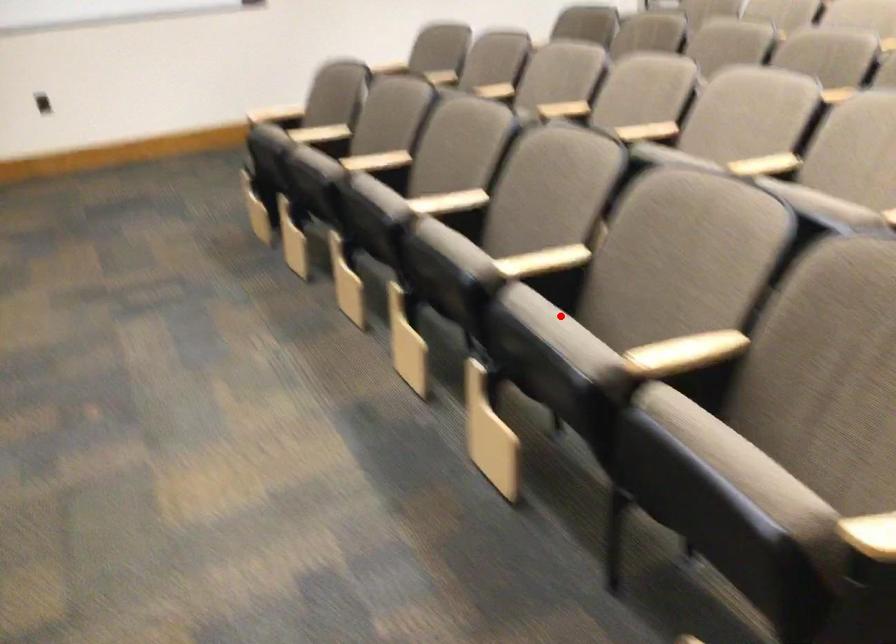
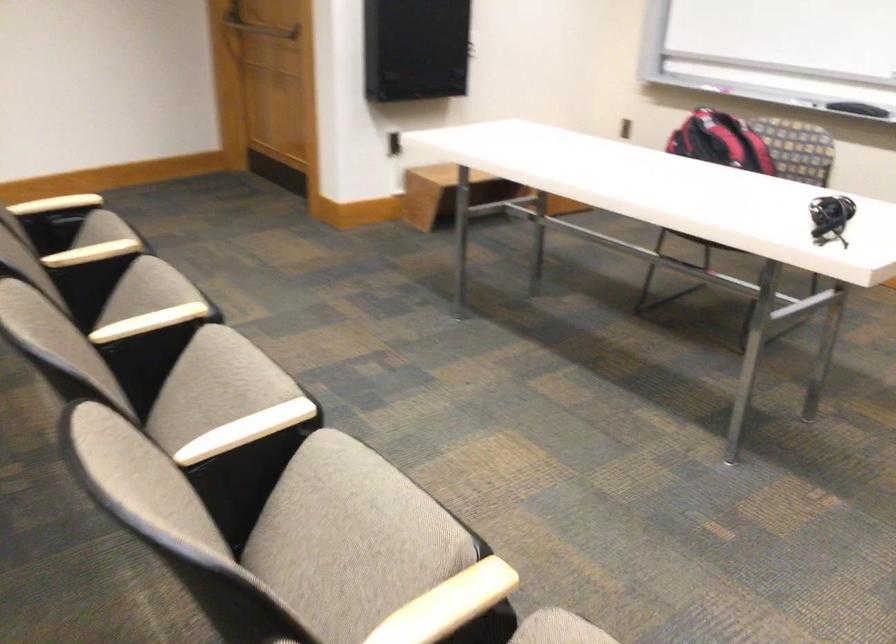
Question: I am providing you with two images of the same scene from different viewpoints. Image1 has a red point marked. In image2, the corresponding 3D location appears at what relative position? Reply with the corresponding letter.

Choices:
 (A) Closer
 (B) Farther

Answer: (B)